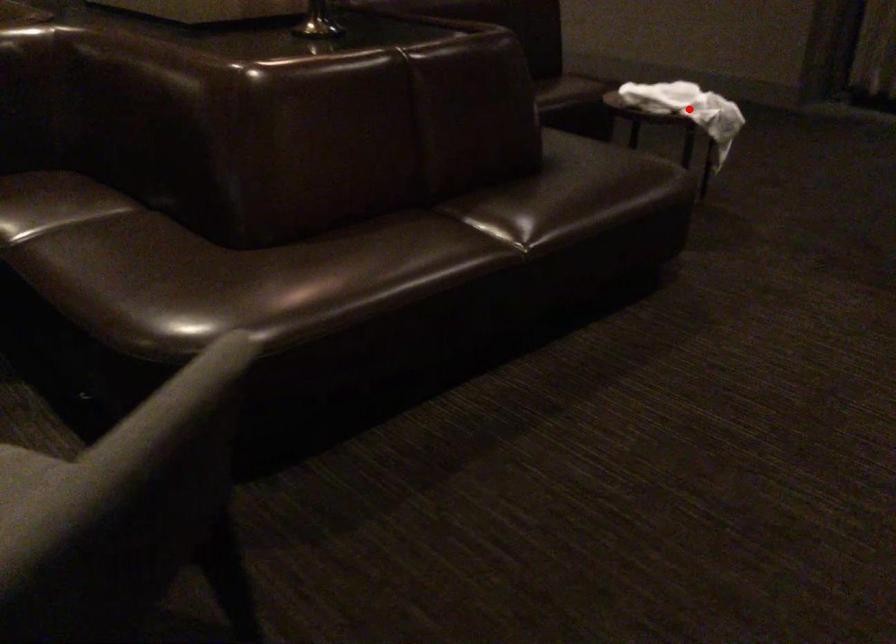
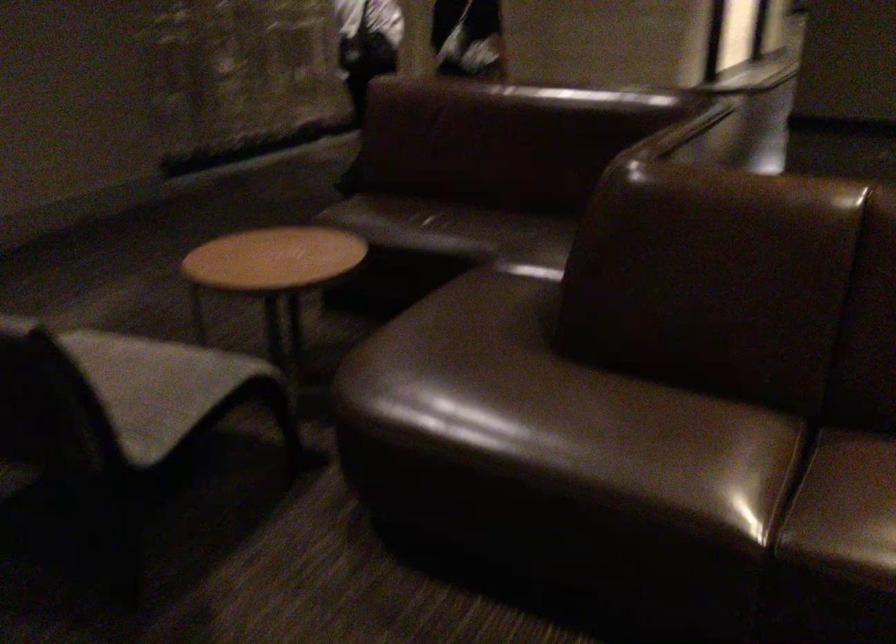
Question: I am providing you with two images of the same scene from different viewpoints. A red point is marked on the first image. At the location where the point appears in image 1, is it still visible in image 2?

Choices:
 (A) Yes
 (B) No

Answer: (B)